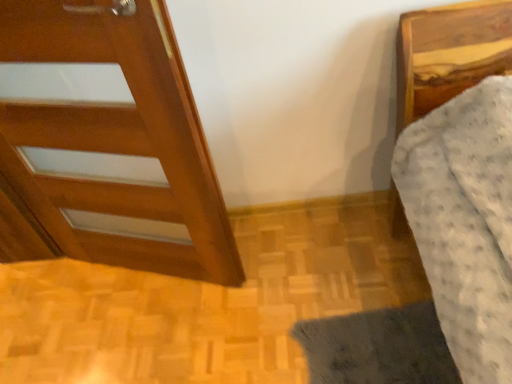
Image resolution: width=512 pixels, height=384 pixels. Identify the location of shiny brown door at left. (116, 138).

Describe the element at coordinates (116, 138) in the screenshot. I see `shiny brown door at left` at that location.

The height and width of the screenshot is (384, 512). In order to click on shiny brown door at left in this screenshot , I will do `click(116, 138)`.